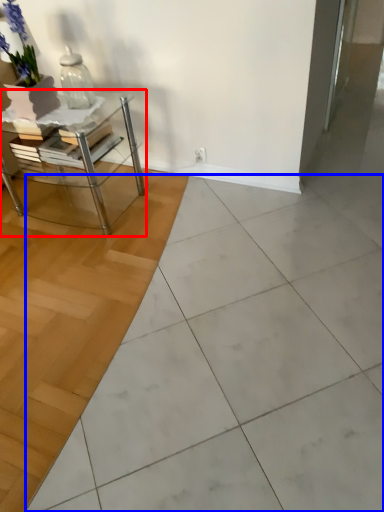
Question: Which object is closer to the camera taking this photo, table (highlighted by a red box) or ceramic tile (highlighted by a blue box)?

Choices:
 (A) table
 (B) ceramic tile

Answer: (B)